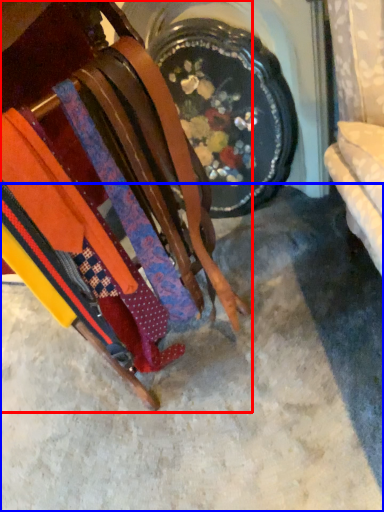
Question: Among these objects, which one is farthest to the camera, furniture (highlighted by a red box) or concrete (highlighted by a blue box)?

Choices:
 (A) furniture
 (B) concrete

Answer: (B)